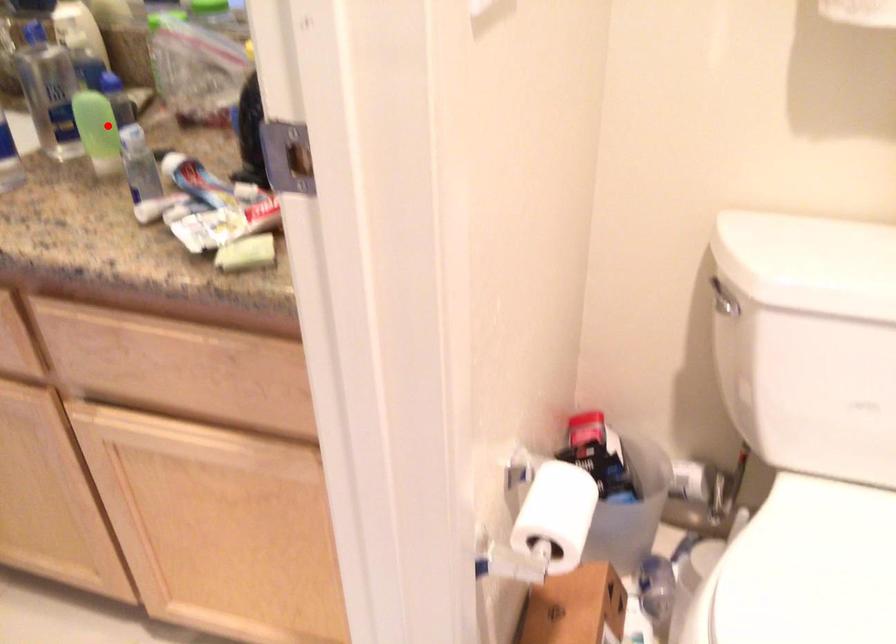
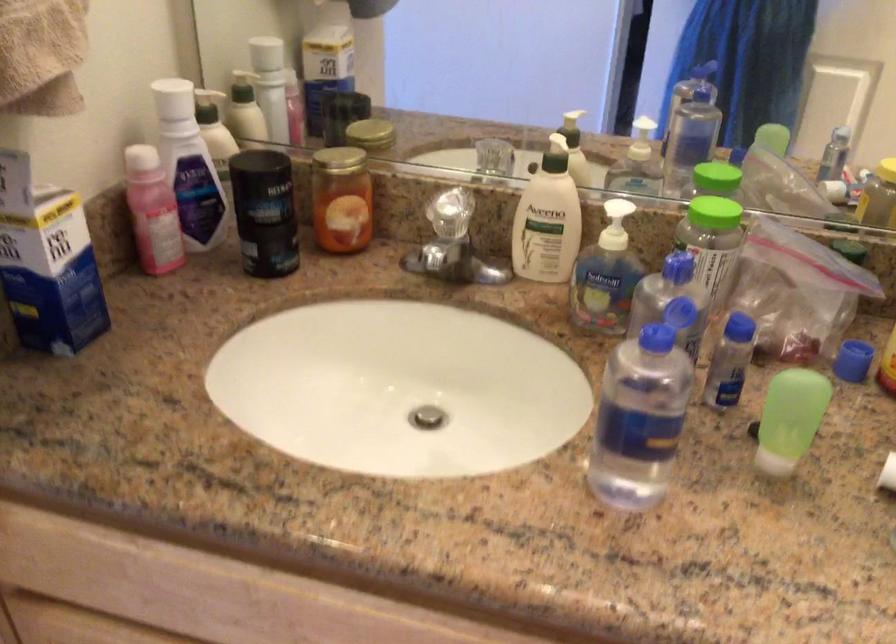
Question: I am providing you with two images of the same scene from different viewpoints. A red point is marked on the first image. Is the red point's position out of view in image 2?

Choices:
 (A) Yes
 (B) No

Answer: (B)